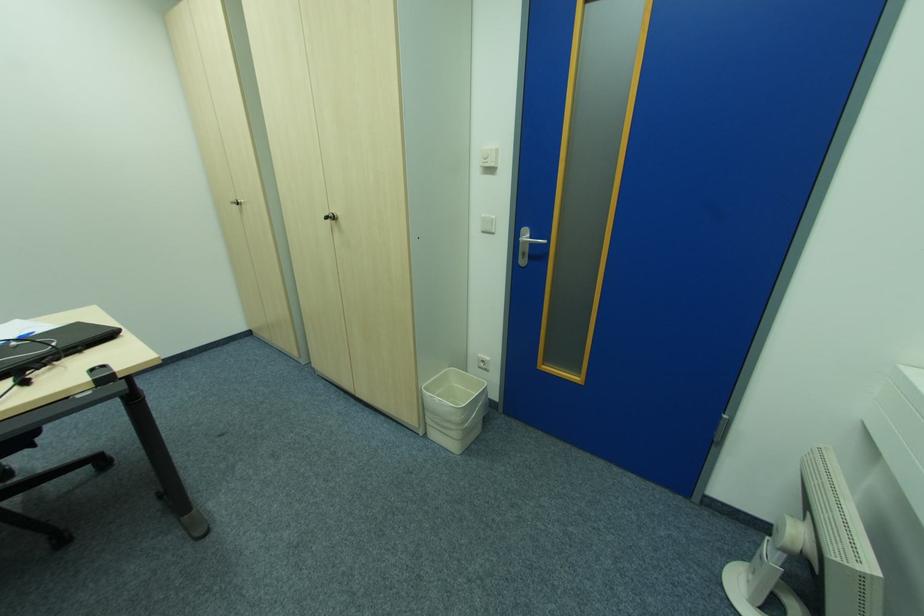
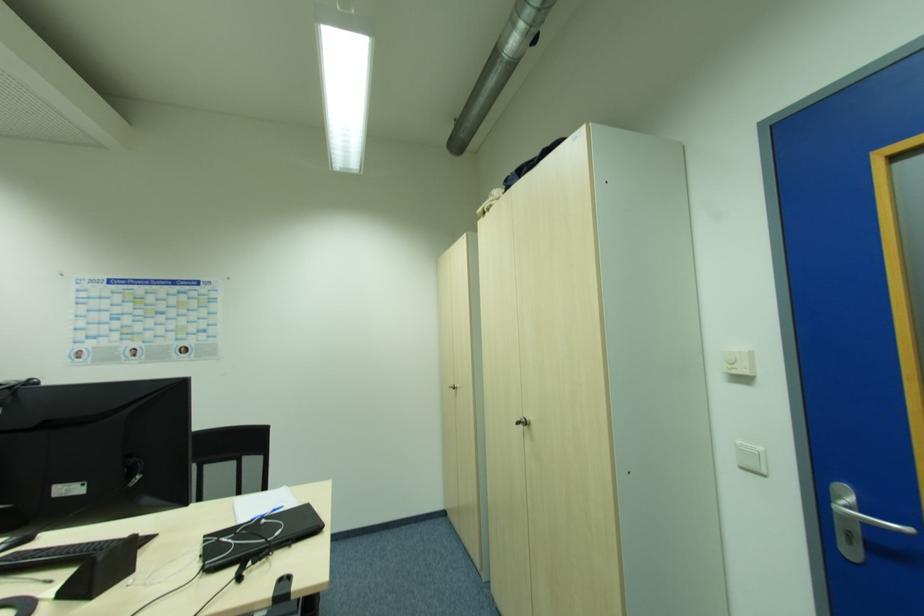
In the second image, find the point that corresponds to (530,236) in the first image.

(855, 501)